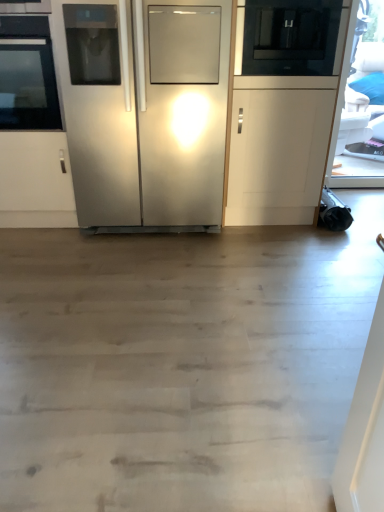
Question: Is stainless steel refrigerator at center far from black glass microwave at upper right?

Choices:
 (A) yes
 (B) no

Answer: (B)

Question: Does stainless steel refrigerator at center have a larger size compared to black glass microwave at upper right?

Choices:
 (A) no
 (B) yes

Answer: (B)

Question: Is stainless steel refrigerator at center further to camera compared to black glass microwave at upper right?

Choices:
 (A) yes
 (B) no

Answer: (B)

Question: From the image's perspective, would you say stainless steel refrigerator at center is positioned over black glass microwave at upper right?

Choices:
 (A) no
 (B) yes

Answer: (A)

Question: Considering the relative positions of stainless steel refrigerator at center and black glass microwave at upper right in the image provided, is stainless steel refrigerator at center to the left of black glass microwave at upper right from the viewer's perspective?

Choices:
 (A) yes
 (B) no

Answer: (A)

Question: Considering the positions of point (317, 15) and point (107, 133), is point (317, 15) closer or farther from the camera than point (107, 133)?

Choices:
 (A) farther
 (B) closer

Answer: (B)

Question: From a real-world perspective, is black glass microwave at upper right above or below stainless steel refrigerator at center?

Choices:
 (A) below
 (B) above

Answer: (B)

Question: From the image's perspective, is black glass microwave at upper right located above or below stainless steel refrigerator at center?

Choices:
 (A) below
 (B) above

Answer: (B)

Question: Is black glass microwave at upper right wider or thinner than stainless steel refrigerator at center?

Choices:
 (A) thin
 (B) wide

Answer: (A)

Question: Is black glass oven at left in front of or behind black glass microwave at upper right in the image?

Choices:
 (A) behind
 (B) front

Answer: (B)

Question: From a real-world perspective, is black glass oven at left positioned above or below black glass microwave at upper right?

Choices:
 (A) above
 (B) below

Answer: (B)

Question: Does point (52, 79) appear closer or farther from the camera than point (339, 65)?

Choices:
 (A) closer
 (B) farther

Answer: (A)

Question: Considering the relative positions of black glass oven at left and black glass microwave at upper right in the image provided, is black glass oven at left to the left or to the right of black glass microwave at upper right?

Choices:
 (A) left
 (B) right

Answer: (A)

Question: In terms of size, does black glass microwave at upper right appear bigger or smaller than black glass oven at left?

Choices:
 (A) small
 (B) big

Answer: (A)

Question: From the image's perspective, relative to black glass oven at left, is black glass microwave at upper right above or below?

Choices:
 (A) below
 (B) above

Answer: (B)